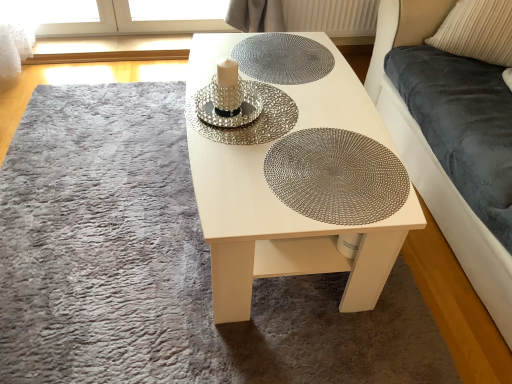
Image resolution: width=512 pixels, height=384 pixels. What are the coordinates of `free point below metallic woven placemat at center, placed as the third glass plate when sorted from top to bottom (from a real-world perspective)` in the screenshot? It's located at (329, 168).